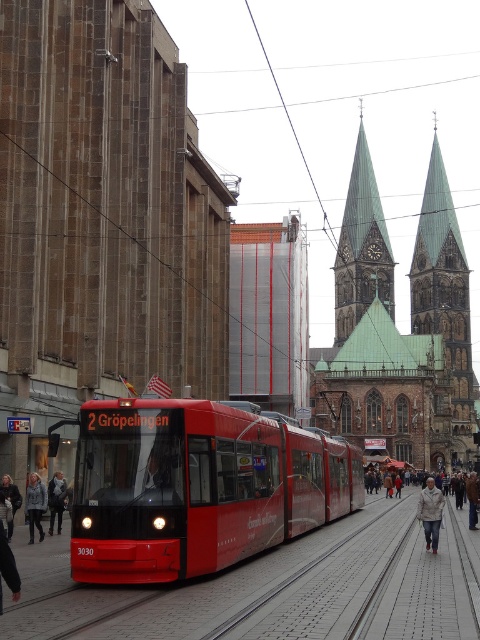
You are a tourist standing on the street looking at the brown stone church at center and the light gray fleece jacket at lower left. Which object is taller?

The brown stone church at center is taller than the light gray fleece jacket at lower left.

You are standing at the tram stop waiting for the red tram labeled 2 Gr?pelingen with the number 3030. You notice a point marked at coordinates [431,513]. What object is located at that point?

The point at coordinates [431,513] corresponds to the white textured coat at lower center.